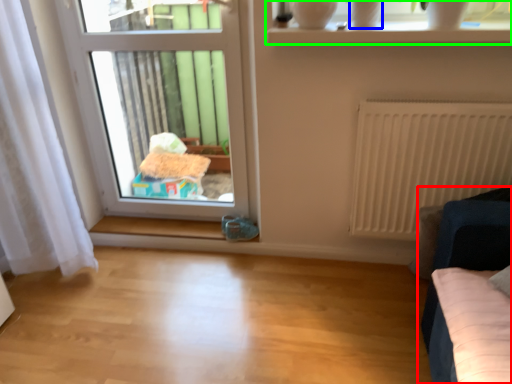
Question: Considering the real-world distances, which object is closest to furniture (highlighted by a red box)? glass vase (highlighted by a blue box) or window (highlighted by a green box).

Choices:
 (A) glass vase
 (B) window

Answer: (B)